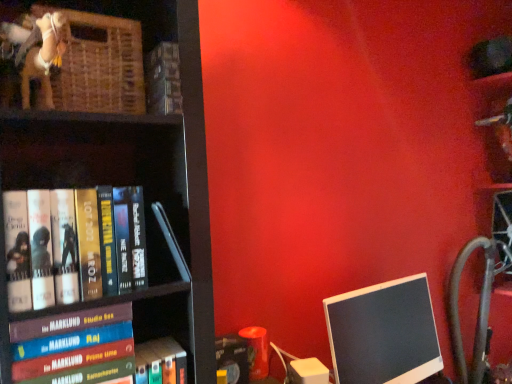
Question: Considering the relative sizes of black glossy monitor at lower right and hardcover book at left, the 4th book when ordered from bottom to top, in the image provided, is black glossy monitor at lower right taller than hardcover book at left, the 4th book when ordered from bottom to top,?

Choices:
 (A) yes
 (B) no

Answer: (A)

Question: Is black glossy monitor at lower right to the right of hardcover book at left, the 4th book when ordered from bottom to top, from the viewer's perspective?

Choices:
 (A) no
 (B) yes

Answer: (B)

Question: Does black glossy monitor at lower right have a lesser width compared to hardcover book at left, the 4th book when ordered from bottom to top?

Choices:
 (A) no
 (B) yes

Answer: (B)

Question: Is there a large distance between black glossy monitor at lower right and hardcover book at left, the 4th book when ordered from bottom to top?

Choices:
 (A) no
 (B) yes

Answer: (A)

Question: Is black glossy monitor at lower right smaller than hardcover book at left, marked as the second book in a top-to-bottom arrangement?

Choices:
 (A) yes
 (B) no

Answer: (B)

Question: Is point (138, 238) closer or farther from the camera than point (357, 332)?

Choices:
 (A) farther
 (B) closer

Answer: (B)

Question: From the image's perspective, is hardcover book at left, the 4th book when ordered from bottom to top, above or below black glossy monitor at lower right?

Choices:
 (A) above
 (B) below

Answer: (A)

Question: Is hardcover book at left, marked as the second book in a top-to-bottom arrangement, taller or shorter than black glossy monitor at lower right?

Choices:
 (A) tall
 (B) short

Answer: (B)

Question: Considering the relative positions of hardcover book at left, the 4th book when ordered from bottom to top, and black glossy monitor at lower right in the image provided, is hardcover book at left, the 4th book when ordered from bottom to top, to the left or to the right of black glossy monitor at lower right?

Choices:
 (A) right
 (B) left

Answer: (B)

Question: In terms of height, does hardcover book at left, marked as the second book in a top-to-bottom arrangement, look taller or shorter compared to hardcover book at upper center, the fifth book in the bottom-to-top sequence?

Choices:
 (A) short
 (B) tall

Answer: (B)

Question: From the image's perspective, is hardcover book at left, the 4th book when ordered from bottom to top, positioned above or below hardcover book at upper center, the fifth book in the bottom-to-top sequence?

Choices:
 (A) above
 (B) below

Answer: (B)

Question: Considering the relative positions of hardcover book at left, the 4th book when ordered from bottom to top, and hardcover book at upper center, the fifth book in the bottom-to-top sequence, in the image provided, is hardcover book at left, the 4th book when ordered from bottom to top, to the left or to the right of hardcover book at upper center, the fifth book in the bottom-to-top sequence,?

Choices:
 (A) right
 (B) left

Answer: (B)

Question: Relative to hardcover book at upper center, arranged as the first book when viewed from the top, is hardcover book at left, the 4th book when ordered from bottom to top, in front or behind?

Choices:
 (A) behind
 (B) front

Answer: (B)

Question: Is point (463, 370) positioned closer to the camera than point (244, 362)?

Choices:
 (A) farther
 (B) closer

Answer: (A)

Question: Looking at the image, does black plastic monitor at right seem bigger or smaller compared to matte black book at lower center, acting as the 5th book starting from the top?

Choices:
 (A) big
 (B) small

Answer: (A)